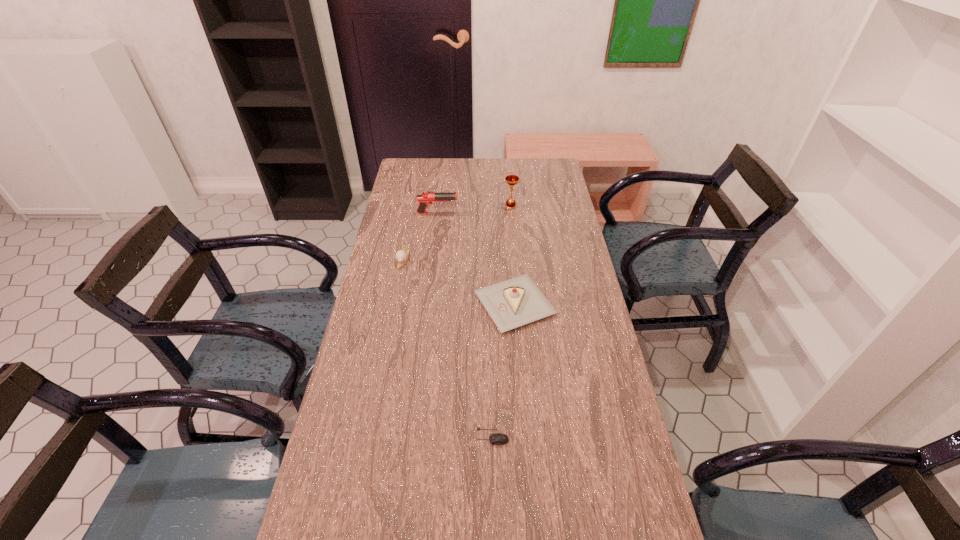
You are a GUI agent. You are given a task and a screenshot of the screen. Output one action in this format:
    pyautogui.click(x=<x>, y=<y>)
    Task: Click on the vacant point at the right edge
    Image resolution: width=960 pixels, height=540 pixels.
    Given the screenshot: What is the action you would take?
    pyautogui.click(x=579, y=317)

You are a GUI agent. You are given a task and a screenshot of the screen. Output one action in this format:
    pyautogui.click(x=<x>, y=<y>)
    Task: Click on the vacant space at the far left corner of the desktop
    
    Given the screenshot: What is the action you would take?
    pyautogui.click(x=415, y=169)

You are a GUI agent. You are given a task and a screenshot of the screen. Output one action in this format:
    pyautogui.click(x=<x>, y=<y>)
    Task: Click on the free region at the far right corner
    The width and height of the screenshot is (960, 540).
    Given the screenshot: What is the action you would take?
    pyautogui.click(x=554, y=177)

This screenshot has height=540, width=960. I want to click on free spot between the third nearest object and the fourth farthest object, so click(x=459, y=282).

Identify the location of free space between the shortest object and the gun. Image resolution: width=960 pixels, height=540 pixels. (465, 325).

Identify the location of free area in between the third farthest object and the fourth farthest object. (459, 282).

Image resolution: width=960 pixels, height=540 pixels. I want to click on vacant space that's between the third farthest object and the second tallest object, so click(420, 236).

Locate an element on the screen. free space between the gun and the tallest object is located at coordinates (474, 210).

Where is `blank region between the fourth farthest object and the fourth nearest object`? The image size is (960, 540). blank region between the fourth farthest object and the fourth nearest object is located at coordinates (476, 259).

I want to click on blank region between the escargot and the cake, so click(x=459, y=282).